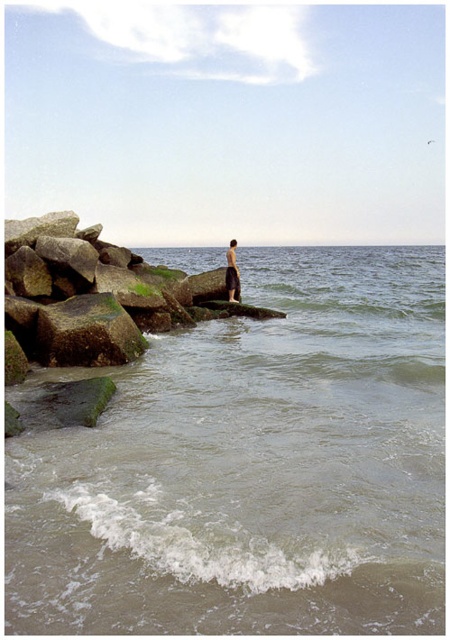
Which of these two, greenish water at lower left or green mossy rock at left, stands taller?

With more height is greenish water at lower left.

Describe the element at coordinates (252, 467) in the screenshot. I see `greenish water at lower left` at that location.

Find the location of a particular element. Image resolution: width=450 pixels, height=640 pixels. greenish water at lower left is located at coordinates (252, 467).

Where is `greenish water at lower left`? The image size is (450, 640). greenish water at lower left is located at coordinates (252, 467).

Does greenish water at lower left have a larger size compared to skinny man at center?

Yes.

Does greenish water at lower left have a smaller size compared to skinny man at center?

Incorrect, greenish water at lower left is not smaller in size than skinny man at center.

Identify the location of greenish water at lower left. pyautogui.click(x=252, y=467).

The width and height of the screenshot is (450, 640). Identify the location of greenish water at lower left. (252, 467).

Which is more to the left, green mossy rock at left or skinny man at center?

From the viewer's perspective, green mossy rock at left appears more on the left side.

Which is in front, point (126, 321) or point (229, 280)?

Point (126, 321)

This screenshot has width=450, height=640. What are the coordinates of `green mossy rock at left` in the screenshot? It's located at (86, 332).